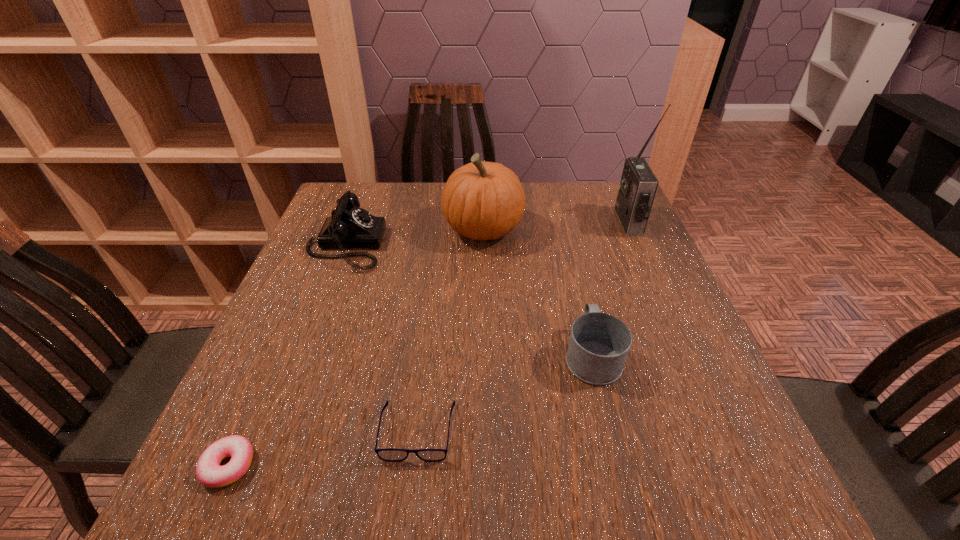
The image size is (960, 540). In order to click on free space that satisfies the following two spatial constraints: 1. on the side of the third nearest object with the handle; 2. on the dial of the telephone in this screenshot , I will do `click(565, 245)`.

I want to click on vacant space that satisfies the following two spatial constraints: 1. on the side of the mug with the handle; 2. on the dial of the third tallest object, so click(565, 245).

At what (x,y) coordinates should I click in order to perform the action: click on free space that satisfies the following two spatial constraints: 1. on the display of the rightmost object; 2. on the front-facing side of the second shortest object. Please return your answer as a coordinate pair (x, y). The height and width of the screenshot is (540, 960). Looking at the image, I should click on (723, 431).

Identify the location of vacant space that satisfies the following two spatial constraints: 1. on the dial of the telephone; 2. on the side of the fourth tallest object with the handle. (303, 355).